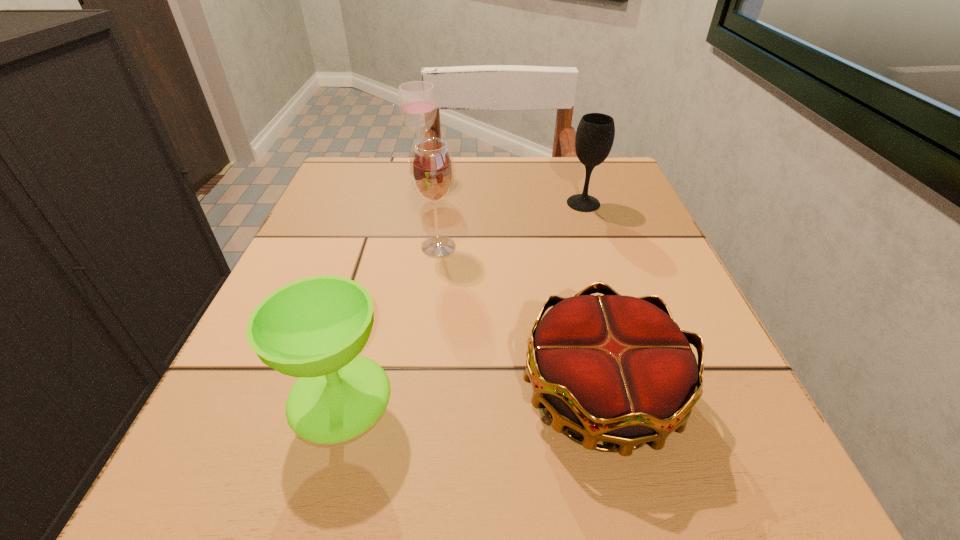
The image size is (960, 540). I want to click on vacant space that is in between the second shortest object and the farthest wineglass, so click(382, 286).

Locate an element on the screen. The width and height of the screenshot is (960, 540). empty location between the second nearest wineglass and the shortest object is located at coordinates (519, 321).

This screenshot has height=540, width=960. In order to click on vacant space in between the shortest wineglass and the fourth nearest object in this screenshot , I will do `click(461, 300)`.

Identify the location of free spot between the shortest wineglass and the crown. This screenshot has width=960, height=540. (469, 395).

Locate an element on the screen. object that stands as the third closest to the crown is located at coordinates (595, 133).

Find the location of a particular element. object that is the third closest one to the third farthest wineglass is located at coordinates 314,328.

Locate which wineglass ranks second in proximity to the shortest object. Please provide its 2D coordinates. Your answer should be formatted as a tuple, i.e. [(x, y)], where the tuple contains the x and y coordinates of a point satisfying the conditions above.

[(432, 170)]

Where is `wineglass identified as the second closest to the third nearest object`? wineglass identified as the second closest to the third nearest object is located at coordinates (314, 328).

Where is `free spot that satisfies the following two spatial constraints: 1. on the front side of the third farthest wineglass; 2. on the left side of the crown`? The image size is (960, 540). free spot that satisfies the following two spatial constraints: 1. on the front side of the third farthest wineglass; 2. on the left side of the crown is located at coordinates [x=421, y=394].

Locate an element on the screen. Image resolution: width=960 pixels, height=540 pixels. vacant space that satisfies the following two spatial constraints: 1. on the front side of the third farthest object; 2. on the right side of the farthest wineglass is located at coordinates (411, 247).